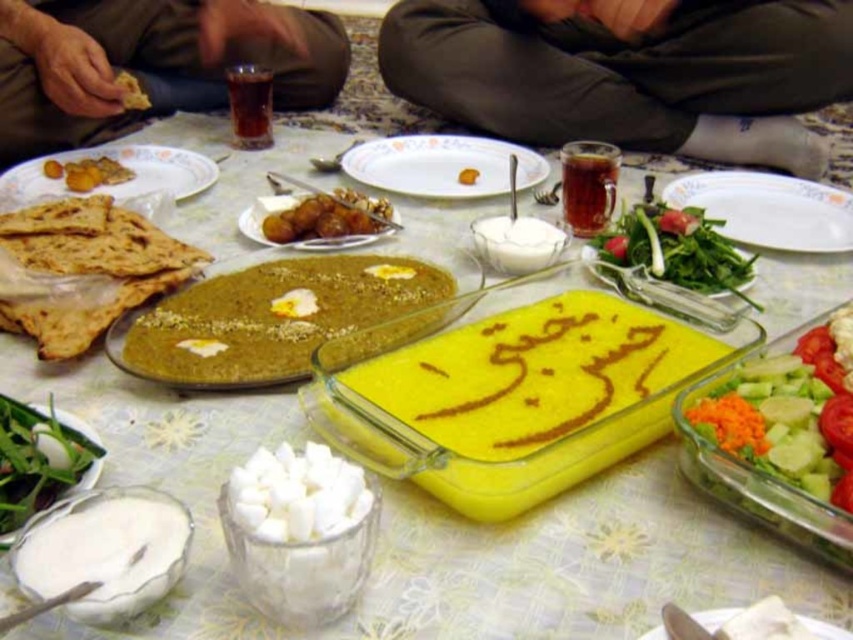
Question: Does green leafy vegetables at lower right have a smaller size compared to yellow matte bread at center?

Choices:
 (A) no
 (B) yes

Answer: (B)

Question: Does dark green pants at center have a greater width compared to golden flatbread at left?

Choices:
 (A) yes
 (B) no

Answer: (A)

Question: Which of the following is the farthest from the observer?

Choices:
 (A) brown fabric pants at upper center
 (B) golden fried pastry at upper left
 (C) golden flatbread at left

Answer: (A)

Question: Which point is closer to the camera?

Choices:
 (A) (115, 81)
 (B) (460, 182)

Answer: (B)

Question: Can you confirm if green leafy vegetable at lower left is positioned above matte brown flatbread at left?

Choices:
 (A) yes
 (B) no

Answer: (B)

Question: Which point is farther to the camera?

Choices:
 (A) (471, 170)
 (B) (78, 179)
 (C) (534, 150)

Answer: (C)